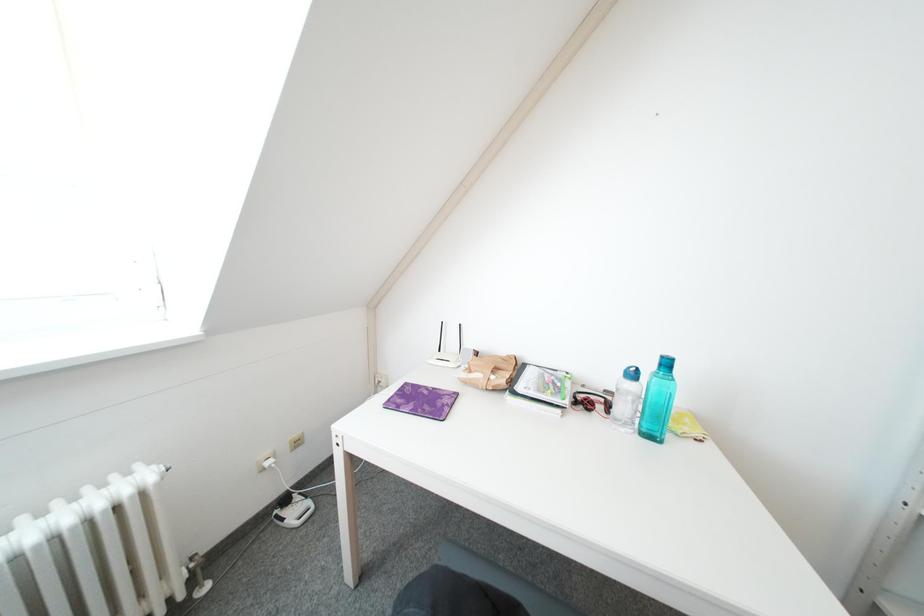
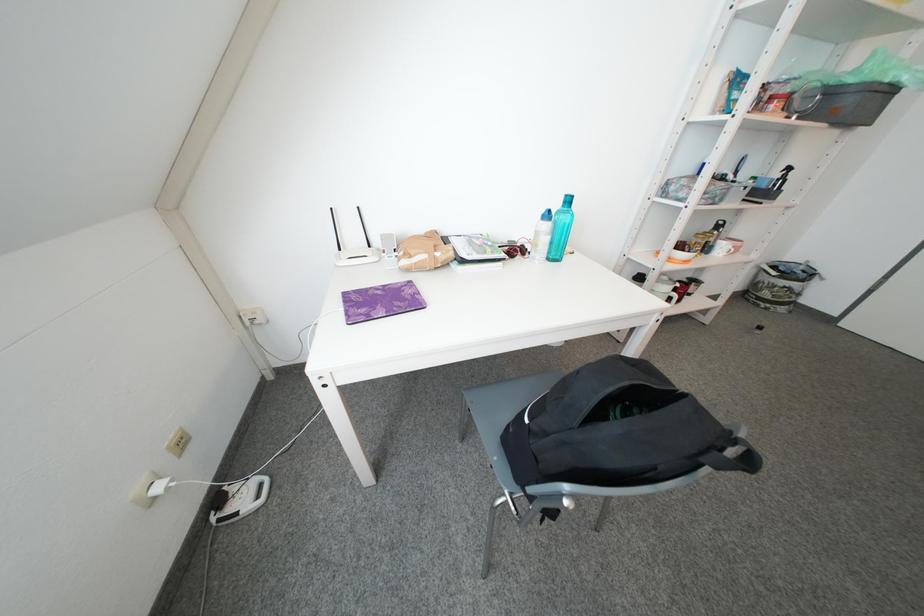
First-person continuous shooting, in which direction is the camera rotating?

The camera rotated toward right-down.